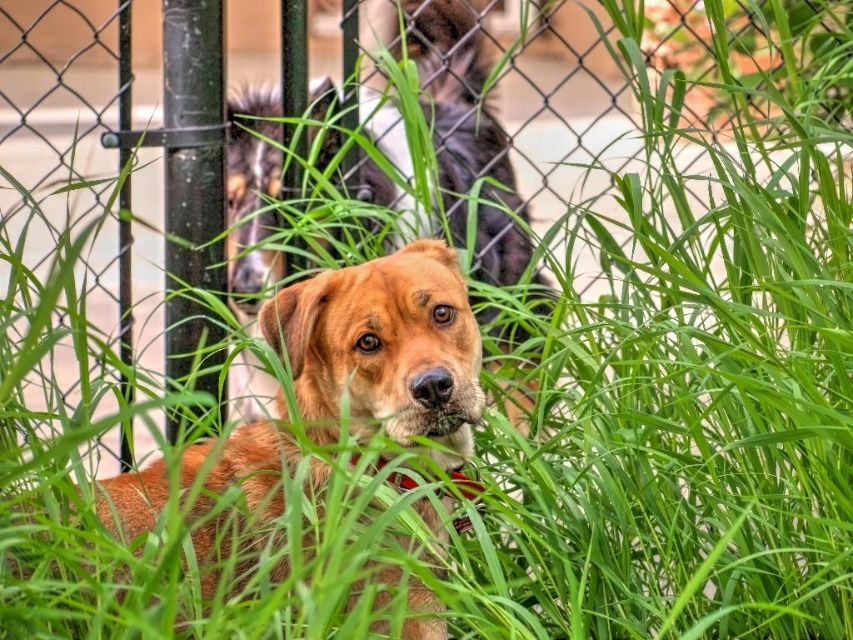
Question: Which object is farther from the camera taking this photo?

Choices:
 (A) red fabric collar at center
 (B) golden brown fur at center
 (C) golden fur dog at center

Answer: (B)

Question: Is golden fur dog at center to the right of red fabric collar at center from the viewer's perspective?

Choices:
 (A) yes
 (B) no

Answer: (B)

Question: Is golden brown fur at center to the left of red fabric collar at center from the viewer's perspective?

Choices:
 (A) no
 (B) yes

Answer: (B)

Question: Which of these objects is positioned farthest from the golden fur dog at center?

Choices:
 (A) golden brown fur at center
 (B) red fabric collar at center

Answer: (A)

Question: Does golden brown fur at center appear on the right side of red fabric collar at center?

Choices:
 (A) no
 (B) yes

Answer: (A)

Question: Which point is closer to the camera taking this photo?

Choices:
 (A) (376, 458)
 (B) (454, 184)
 (C) (253, 451)

Answer: (A)